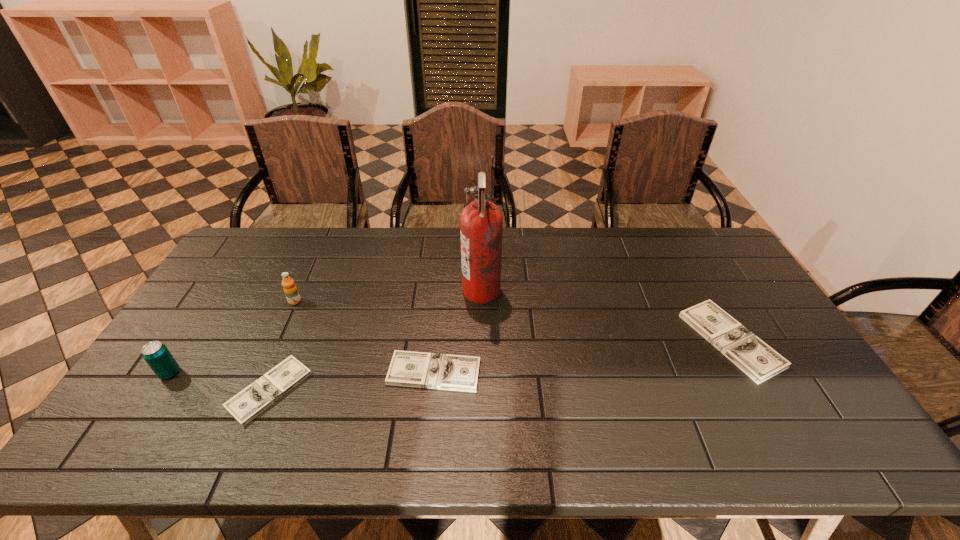
This screenshot has height=540, width=960. Find the location of `vacant position at the left edge of the desktop`. vacant position at the left edge of the desktop is located at coordinates (206, 353).

Identify the location of vacant space at the far left corner of the desktop. (252, 230).

This screenshot has height=540, width=960. In order to click on vacant space at the near right corner of the desktop in this screenshot , I will do `click(790, 418)`.

The image size is (960, 540). I want to click on vacant area that lies between the beer can and the orange juice, so click(232, 337).

Where is `empty space between the second dollar from right to left and the fire extinguisher`? The height and width of the screenshot is (540, 960). empty space between the second dollar from right to left and the fire extinguisher is located at coordinates point(458,332).

Where is `vacant space in between the leftmost dollar and the tallest object`? vacant space in between the leftmost dollar and the tallest object is located at coordinates (375, 341).

The height and width of the screenshot is (540, 960). I want to click on empty space that is in between the second dollar from right to left and the shortest object, so click(x=352, y=381).

The image size is (960, 540). Identify the location of vacant space in between the rightmost object and the orange juice. (513, 321).

The image size is (960, 540). I want to click on vacant space that is in between the rightmost object and the fifth tallest object, so click(x=583, y=356).

Locate an element on the screen. The image size is (960, 540). empty space between the second shortest object and the orange juice is located at coordinates (365, 337).